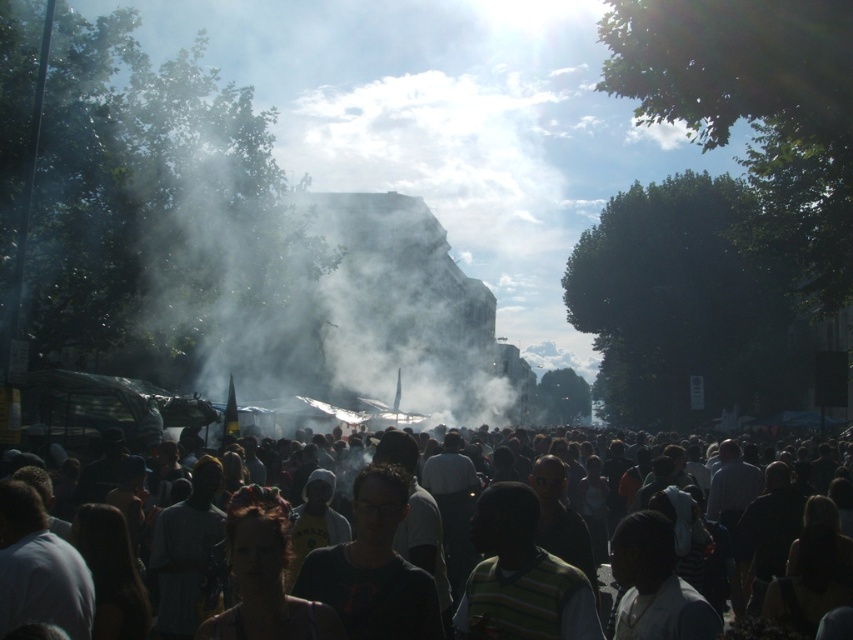
Is dark clothing crowd at center below striped cotton shirt at center?

Incorrect, dark clothing crowd at center is not positioned below striped cotton shirt at center.

Does dark clothing crowd at center have a greater width compared to striped cotton shirt at center?

Yes.

You are a GUI agent. You are given a task and a screenshot of the screen. Output one action in this format:
    pyautogui.click(x=<x>, y=<y>)
    Task: Click on the dark clothing crowd at center
    This screenshot has height=640, width=853.
    Given the screenshot: What is the action you would take?
    pyautogui.click(x=762, y=531)

Is white vapor at center further to the viewer compared to striped cotton shirt at center?

Yes, white vapor at center is further from the viewer.

Which is in front, point (300, 353) or point (473, 536)?

Point (473, 536)

Locate an element on the screen. This screenshot has width=853, height=640. white vapor at center is located at coordinates (399, 301).

Does white vapor at center have a smaller size compared to dark clothing crowd at center?

Incorrect, white vapor at center is not smaller in size than dark clothing crowd at center.

Where is `white vapor at center`? white vapor at center is located at coordinates (399, 301).